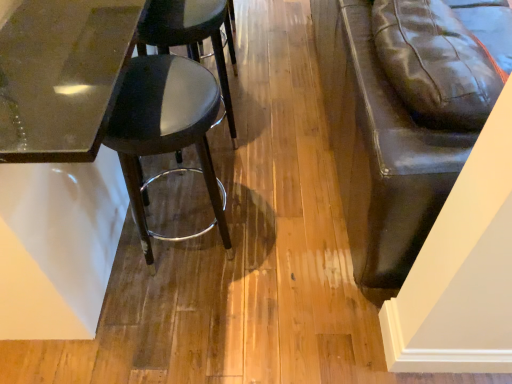
This screenshot has height=384, width=512. Identify the location of vacant area to the right of matte black stool at left, which is the first stool from bottom to top. (275, 239).